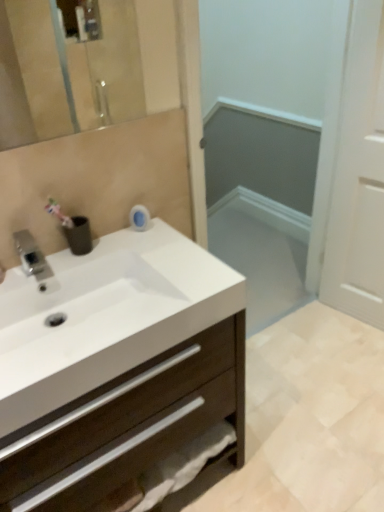
What do you see at coordinates (271, 141) in the screenshot? This screenshot has height=512, width=384. I see `white glossy screen door at center, the first screen door when ordered from left to right` at bounding box center [271, 141].

This screenshot has height=512, width=384. I want to click on white matte cabinet at center, so click(x=115, y=365).

From the image's perspective, is white matte door at right, the first screen door when ordered from right to left, positioned above or below silver metallic faucet at upper left?

Based on their image positions, white matte door at right, the first screen door when ordered from right to left, is located above silver metallic faucet at upper left.

Is point (366, 179) closer to viewer compared to point (30, 271)?

No.

In the scene shown: Which object is closer to the camera, white matte door at right, the first screen door when ordered from right to left, or silver metallic faucet at upper left?

silver metallic faucet at upper left is closer to the camera.

Is silver metallic faucet at upper left taller or shorter than white matte cabinet at center?

In the image, silver metallic faucet at upper left appears to be shorter than white matte cabinet at center.

Is silver metallic faucet at upper left located outside white matte cabinet at center?

Yes.

From a real-world perspective, is silver metallic faucet at upper left positioned under white matte cabinet at center based on gravity?

Actually, silver metallic faucet at upper left is physically above white matte cabinet at center in the real world.

From the picture: Is there a large distance between silver metallic faucet at upper left and white matte cabinet at center?

That's not correct — silver metallic faucet at upper left is a little close to white matte cabinet at center.

Considering the relative sizes of silver metallic faucet at upper left and white matte door at right, the first screen door when ordered from right to left, in the image provided, is silver metallic faucet at upper left taller than white matte door at right, the first screen door when ordered from right to left,?

No, silver metallic faucet at upper left is not taller than white matte door at right, the first screen door when ordered from right to left.

Consider the image. Is silver metallic faucet at upper left directly adjacent to white matte door at right, which is the 2th screen door in left-to-right order?

silver metallic faucet at upper left and white matte door at right, which is the 2th screen door in left-to-right order, are not in contact.

Is silver metallic faucet at upper left bigger or smaller than white matte door at right, which is the 2th screen door in left-to-right order?

Clearly, silver metallic faucet at upper left is smaller in size than white matte door at right, which is the 2th screen door in left-to-right order.

From a real-world perspective, is silver metallic faucet at upper left under white matte door at right, which is the 2th screen door in left-to-right order?

Actually, silver metallic faucet at upper left is physically above white matte door at right, which is the 2th screen door in left-to-right order, in the real world.

Can you tell me how much white matte cabinet at center and white glossy screen door at center, which appears as the 2th screen door when viewed from the right, differ in facing direction?

The facing directions of white matte cabinet at center and white glossy screen door at center, which appears as the 2th screen door when viewed from the right, are 4.09e-06 degrees apart.

Could you tell me if white matte cabinet at center is turned towards white glossy screen door at center, the first screen door when ordered from left to right?

No, white matte cabinet at center is not facing towards white glossy screen door at center, the first screen door when ordered from left to right.

Identify the location of bathroom cabinet to the left of white glossy screen door at center, the first screen door when ordered from left to right. (115, 365).

How distant is white matte cabinet at center from white glossy screen door at center, which appears as the 2th screen door when viewed from the right?

white matte cabinet at center is 1.35 meters away from white glossy screen door at center, which appears as the 2th screen door when viewed from the right.

Is white glossy screen door at center, the first screen door when ordered from left to right, turned away from white matte cabinet at center?

white glossy screen door at center, the first screen door when ordered from left to right, is not turned away from white matte cabinet at center.

From the image's perspective, between white glossy screen door at center, the first screen door when ordered from left to right, and white matte cabinet at center, which one is located above?

white glossy screen door at center, the first screen door when ordered from left to right, appears higher in the image.

In the image, is white glossy screen door at center, the first screen door when ordered from left to right, positioned in front of or behind white matte cabinet at center?

white glossy screen door at center, the first screen door when ordered from left to right, is positioned farther from the viewer than white matte cabinet at center.

How different are the orientations of white glossy screen door at center, the first screen door when ordered from left to right, and white matte cabinet at center in degrees?

The facing directions of white glossy screen door at center, the first screen door when ordered from left to right, and white matte cabinet at center are 4.09e-06 degrees apart.

From the image's perspective, is silver metallic faucet at upper left located above or below white glossy screen door at center, the first screen door when ordered from left to right?

From the image's perspective, silver metallic faucet at upper left appears below white glossy screen door at center, the first screen door when ordered from left to right.

From the image's perspective, which screen door is the 1st one above the silver metallic faucet at upper left? Please provide its 2D coordinates.

[(271, 141)]

From a real-world perspective, is silver metallic faucet at upper left positioned under white glossy screen door at center, which appears as the 2th screen door when viewed from the right, based on gravity?

Actually, silver metallic faucet at upper left is physically above white glossy screen door at center, which appears as the 2th screen door when viewed from the right, in the real world.

Can you confirm if white glossy screen door at center, which appears as the 2th screen door when viewed from the right, is positioned to the right of silver metallic faucet at upper left?

Yes.

How much distance is there between white glossy screen door at center, which appears as the 2th screen door when viewed from the right, and silver metallic faucet at upper left?

white glossy screen door at center, which appears as the 2th screen door when viewed from the right, is 6.21 feet away from silver metallic faucet at upper left.

From the image's perspective, relative to silver metallic faucet at upper left, is white glossy screen door at center, which appears as the 2th screen door when viewed from the right, above or below?

white glossy screen door at center, which appears as the 2th screen door when viewed from the right, is situated higher than silver metallic faucet at upper left in the image.

From a real-world perspective, is white glossy screen door at center, the first screen door when ordered from left to right, positioned above or below silver metallic faucet at upper left?

Clearly, from a real-world perspective, white glossy screen door at center, the first screen door when ordered from left to right, is below silver metallic faucet at upper left.

What are the coordinates of `screen door that is the 2nd object located behind the silver metallic faucet at upper left` in the screenshot? It's located at (359, 176).

You are a GUI agent. You are given a task and a screenshot of the screen. Output one action in this format:
    pyautogui.click(x=<x>, y=<y>)
    Task: Click on the tap on the left of white matte cabinet at center
    The height and width of the screenshot is (512, 384).
    Given the screenshot: What is the action you would take?
    pyautogui.click(x=31, y=256)

Which object lies further to the anchor point silver metallic faucet at upper left, white matte cabinet at center or white matte door at right, which is the 2th screen door in left-to-right order?

white matte door at right, which is the 2th screen door in left-to-right order, lies further to silver metallic faucet at upper left than the other object.

Estimate the real-world distances between objects in this image. Which object is further from white matte door at right, the first screen door when ordered from right to left, white matte cabinet at center or white glossy screen door at center, which appears as the 2th screen door when viewed from the right?

Among the two, white matte cabinet at center is located further to white matte door at right, the first screen door when ordered from right to left.

Based on their spatial positions, is white glossy screen door at center, the first screen door when ordered from left to right, or silver metallic faucet at upper left further from white matte cabinet at center?

Based on the image, white glossy screen door at center, the first screen door when ordered from left to right, appears to be further to white matte cabinet at center.

From the image, which object appears to be nearer to white matte door at right, which is the 2th screen door in left-to-right order, silver metallic faucet at upper left or white matte cabinet at center?

white matte cabinet at center.

Looking at the image, which one is located closer to silver metallic faucet at upper left, white matte door at right, the first screen door when ordered from right to left, or white glossy screen door at center, the first screen door when ordered from left to right?

The object closer to silver metallic faucet at upper left is white matte door at right, the first screen door when ordered from right to left.

Estimate the real-world distances between objects in this image. Which object is further from white glossy screen door at center, the first screen door when ordered from left to right, silver metallic faucet at upper left or white matte cabinet at center?

silver metallic faucet at upper left is positioned further to the anchor white glossy screen door at center, the first screen door when ordered from left to right.

When comparing their distances from silver metallic faucet at upper left, does white glossy screen door at center, the first screen door when ordered from left to right, or white matte door at right, which is the 2th screen door in left-to-right order, seem closer?

white matte door at right, which is the 2th screen door in left-to-right order.

Estimate the real-world distances between objects in this image. Which object is further from silver metallic faucet at upper left, white matte door at right, which is the 2th screen door in left-to-right order, or white matte cabinet at center?

Based on the image, white matte door at right, which is the 2th screen door in left-to-right order, appears to be further to silver metallic faucet at upper left.

The height and width of the screenshot is (512, 384). Identify the location of screen door located between white matte cabinet at center and white matte door at right, which is the 2th screen door in left-to-right order, in the left-right direction. (271, 141).

This screenshot has width=384, height=512. Identify the location of bathroom cabinet between silver metallic faucet at upper left and white glossy screen door at center, which appears as the 2th screen door when viewed from the right, from left to right. (115, 365).

Identify the location of bathroom cabinet between silver metallic faucet at upper left and white matte door at right, which is the 2th screen door in left-to-right order, in the horizontal direction. (115, 365).

Find the location of a particular element. The width and height of the screenshot is (384, 512). screen door situated between silver metallic faucet at upper left and white matte door at right, the first screen door when ordered from right to left, from left to right is located at coordinates (271, 141).